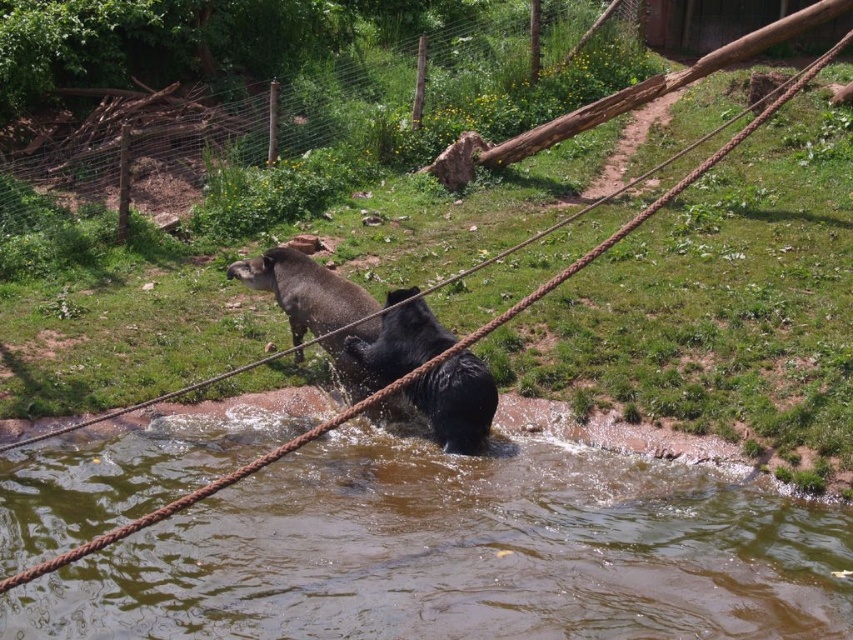
Question: Does brown muddy water at lower center appear on the right side of shiny black bear at center?

Choices:
 (A) no
 (B) yes

Answer: (B)

Question: Is brown muddy water at lower center to the right of shiny black bear at center from the viewer's perspective?

Choices:
 (A) no
 (B) yes

Answer: (B)

Question: Which point is closer to the camera?

Choices:
 (A) (22, 628)
 (B) (413, 330)

Answer: (A)

Question: Is the position of brown muddy water at lower center more distant than that of shiny black bear at center?

Choices:
 (A) yes
 (B) no

Answer: (B)

Question: Which point appears farthest from the camera in this image?

Choices:
 (A) (701, 522)
 (B) (469, 420)

Answer: (B)